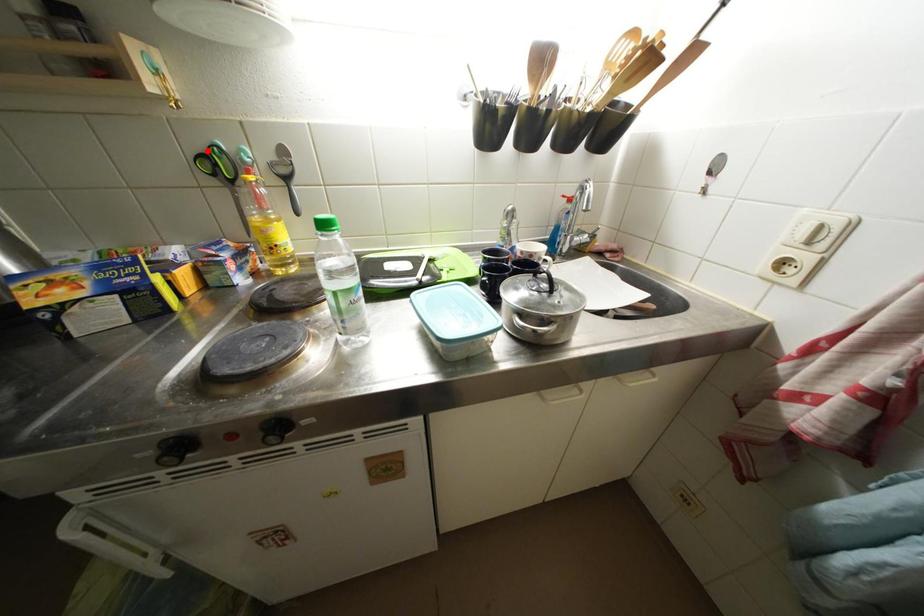
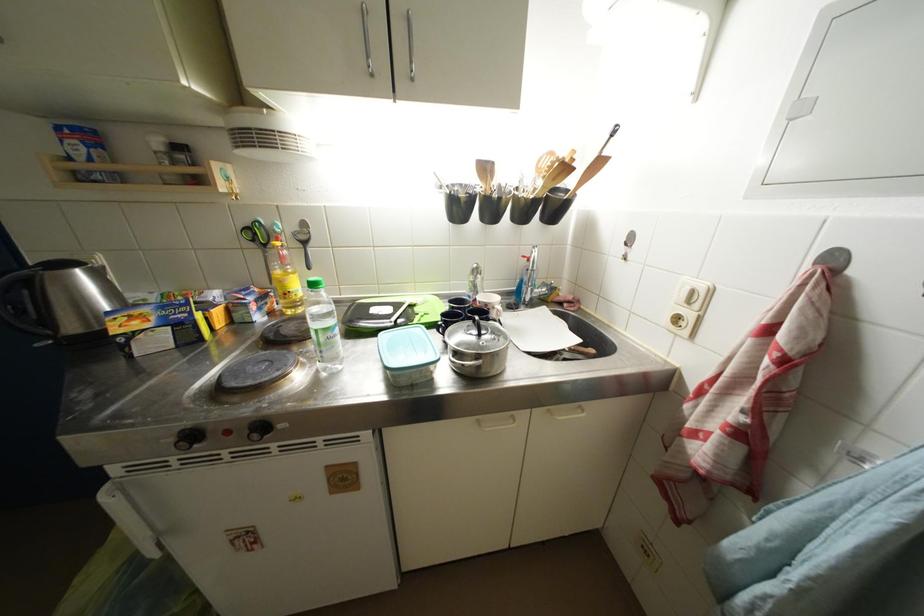
Find the pixel in the second image that matches the highlighted location in the first image.

(253, 227)